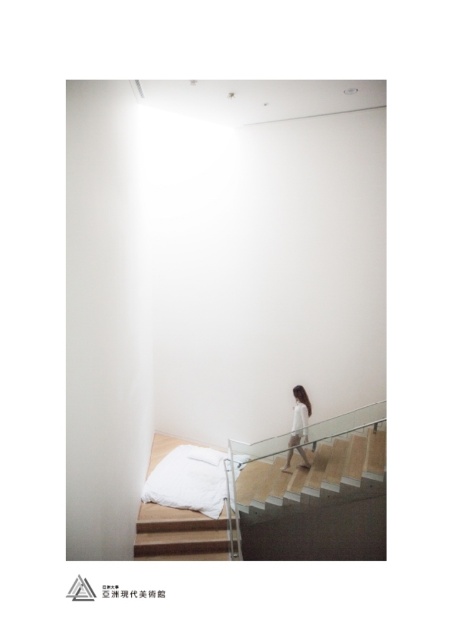
You are an interior designer planning to install a new lighting fixture in the minimalist space. The wooden staircase at center and the white matte dress at center are both in the center. Which object is positioned lower in the scene?

The wooden staircase at center is located below the white matte dress at center, so it is positioned lower in the scene.

You are an interior designer planning to place a new rug in the space. The rug must be wider than the white matte dress at center but narrower than the wooden staircase at center. Is this possible given their current widths?

Yes, since the wooden staircase at center is wider than the white matte dress at center, there is a width range between them where the rug can fit.

You are an interior designer planning to place a decorative rug on the floor. The rug must be wider than the white matte dress at center but narrower than the wooden stair at lower center. Is this possible given the current dimensions?

Yes, since the wooden stair at lower center is wider than the white matte dress at center, there is a width range between them where the rug can fit.